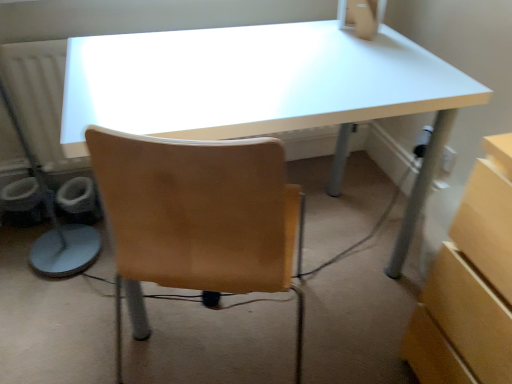
Question: Would you say white glossy desk at center is to the left or to the right of matte beige desktop computer at upper center in the picture?

Choices:
 (A) left
 (B) right

Answer: (A)

Question: Does point (139, 66) appear closer or farther from the camera than point (373, 9)?

Choices:
 (A) closer
 (B) farther

Answer: (A)

Question: Is white glossy desk at center taller or shorter than matte beige desktop computer at upper center?

Choices:
 (A) short
 (B) tall

Answer: (B)

Question: From a real-world perspective, is matte beige desktop computer at upper center above or below white glossy desk at center?

Choices:
 (A) above
 (B) below

Answer: (A)

Question: Based on their sizes in the image, would you say matte beige desktop computer at upper center is bigger or smaller than white glossy desk at center?

Choices:
 (A) big
 (B) small

Answer: (B)

Question: Is matte beige desktop computer at upper center inside or outside of white glossy desk at center?

Choices:
 (A) inside
 (B) outside

Answer: (B)

Question: Based on their positions, is matte beige desktop computer at upper center located to the left or right of white glossy desk at center?

Choices:
 (A) left
 (B) right

Answer: (B)